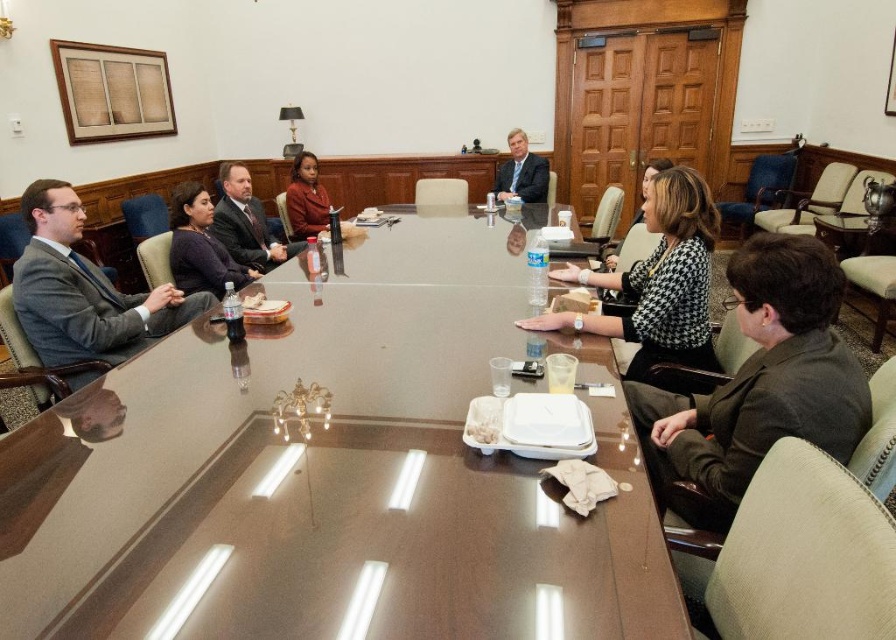
Question: Which object appears farthest from the camera in this image?

Choices:
 (A) matte black suit at left
 (B) matte gray suit at left

Answer: (A)

Question: Can you confirm if black houndstooth dress at center is wider than dark gray sweater at left?

Choices:
 (A) yes
 (B) no

Answer: (A)

Question: Is matte black suit at left bigger than matte black suit at upper center?

Choices:
 (A) no
 (B) yes

Answer: (B)

Question: Does matte black suit at left come in front of matte black suit at upper center?

Choices:
 (A) yes
 (B) no

Answer: (A)

Question: Among these points, which one is farthest from the camera?

Choices:
 (A) (248, 184)
 (B) (195, 214)
 (C) (314, 168)
 (D) (696, 189)

Answer: (C)

Question: Which point is farther to the camera?

Choices:
 (A) tap(79, 276)
 (B) tap(308, 188)

Answer: (B)